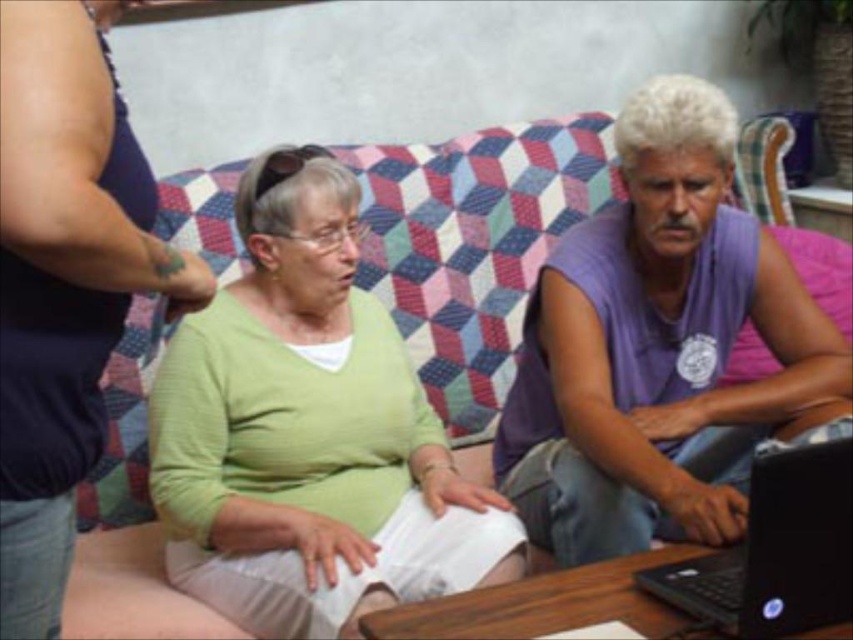
Question: Is green matte sweater at center positioned at the back of matte green sweater at center?

Choices:
 (A) no
 (B) yes

Answer: (B)

Question: Which of the following is the closest to the observer?

Choices:
 (A) (61, 56)
 (B) (850, 584)
 (C) (294, 298)

Answer: (A)

Question: Is the position of purple sleeveless shirt at right less distant than that of matte green sweater at center?

Choices:
 (A) no
 (B) yes

Answer: (A)

Question: Which point is closer to the camera?

Choices:
 (A) (154, 236)
 (B) (822, 595)
 (C) (701, 488)

Answer: (B)

Question: Is purple sleeveless shirt at right to the right of black plastic laptop at lower right from the viewer's perspective?

Choices:
 (A) yes
 (B) no

Answer: (A)

Question: Which point is farther to the camera?

Choices:
 (A) purple sleeveless shirt at right
 (B) black plastic laptop at lower right
 (C) matte green sweater at center

Answer: (A)